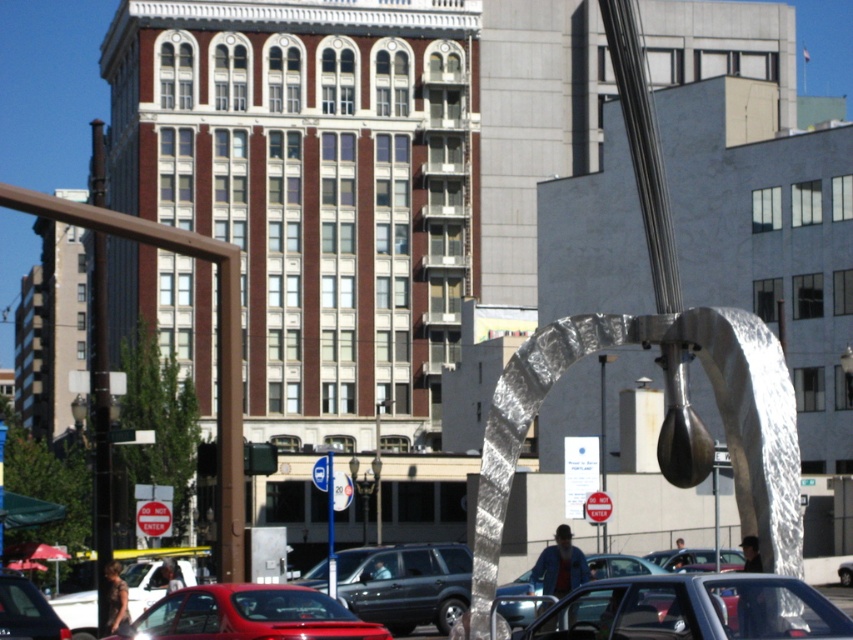
You are driving a matte red car at lower left and want to park as close as possible to the brushed metal pole at center without hitting it. What is the minimum safe distance you should maintain?

The minimum safe distance you should maintain between the matte red car at lower left and the brushed metal pole at center is 6.26 meters to avoid collision.